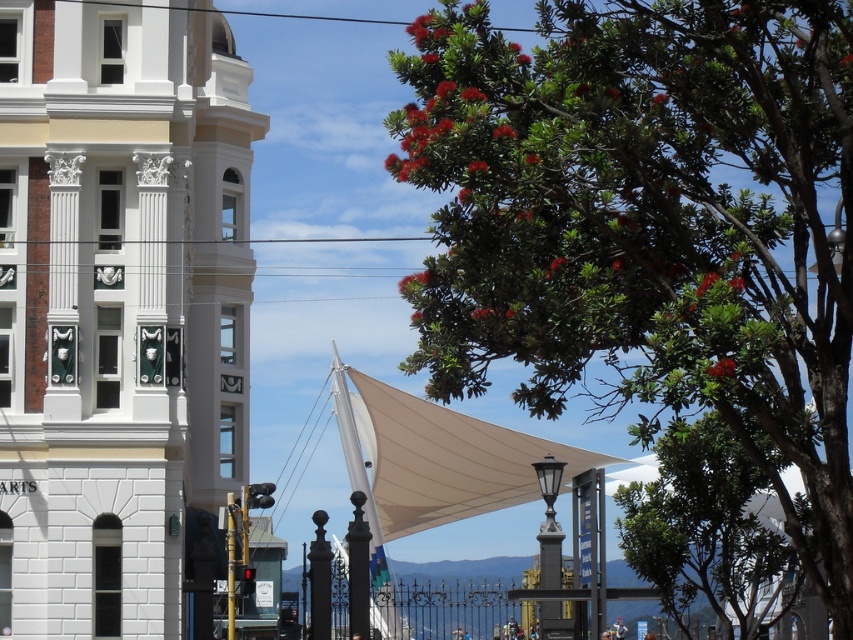
Question: Does white stone bell tower at left come in front of green leafy tree at center?

Choices:
 (A) no
 (B) yes

Answer: (A)

Question: Among these objects, which one is nearest to the camera?

Choices:
 (A) white stone bell tower at left
 (B) green leafy tree at center

Answer: (B)

Question: Is green leafy tree at center wider than white fabric canopy at center?

Choices:
 (A) no
 (B) yes

Answer: (A)

Question: Is white stone bell tower at left to the left of white fabric canopy at center from the viewer's perspective?

Choices:
 (A) no
 (B) yes

Answer: (B)

Question: Among these objects, which one is nearest to the camera?

Choices:
 (A) white stone bell tower at left
 (B) green leafy tree at center

Answer: (B)

Question: Which of the following is the closest to the observer?

Choices:
 (A) (436, 220)
 (B) (727, 548)

Answer: (A)